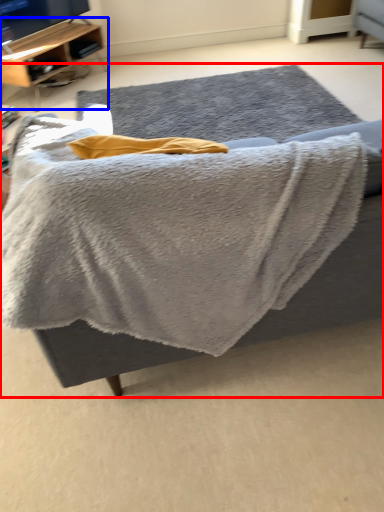
Question: Which object appears farthest to the camera in this image, furniture (highlighted by a red box) or shelf (highlighted by a blue box)?

Choices:
 (A) furniture
 (B) shelf

Answer: (B)